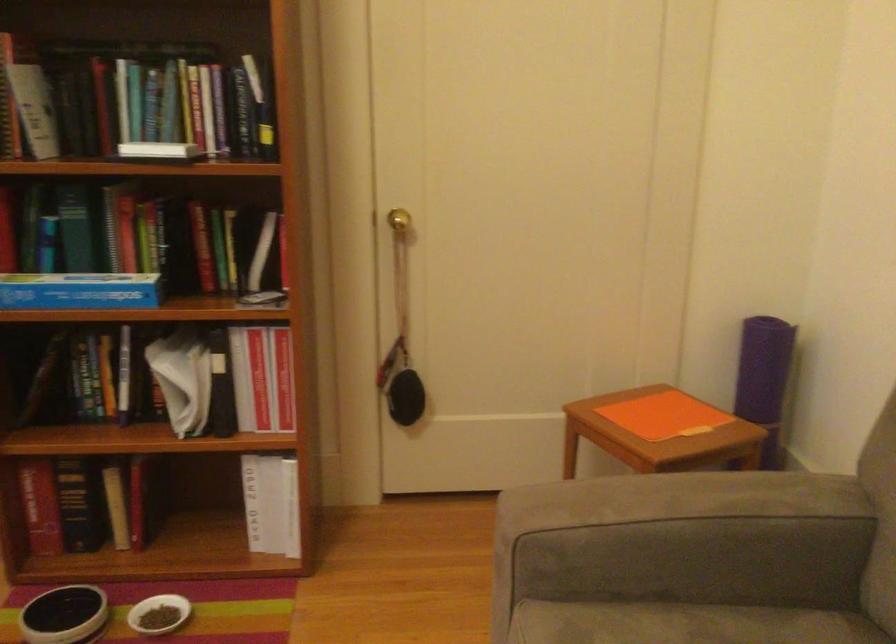
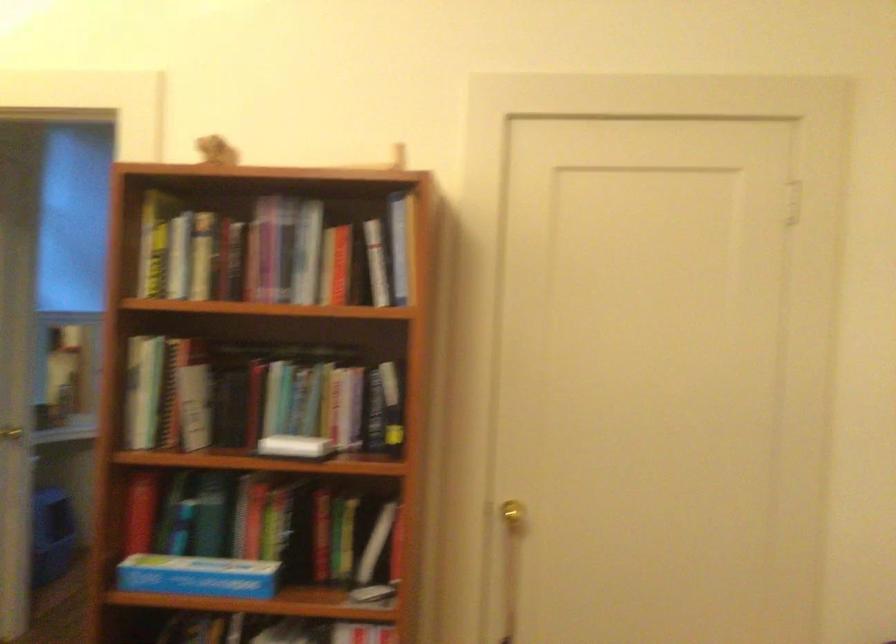
In the second image, find the point that corresponds to (x=235, y=248) in the first image.

(351, 536)